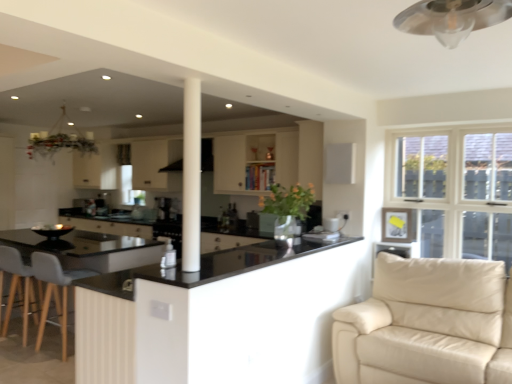
Question: Is satin black coffee machine at center positioned behind gray fabric swivel chair at lower left?

Choices:
 (A) no
 (B) yes

Answer: (B)

Question: Is satin black coffee machine at center to the left of gray fabric swivel chair at lower left from the viewer's perspective?

Choices:
 (A) no
 (B) yes

Answer: (A)

Question: Is satin black coffee machine at center not within gray fabric swivel chair at lower left?

Choices:
 (A) no
 (B) yes

Answer: (B)

Question: Can you confirm if satin black coffee machine at center is taller than gray fabric swivel chair at lower left?

Choices:
 (A) no
 (B) yes

Answer: (A)

Question: Can you confirm if satin black coffee machine at center is smaller than gray fabric swivel chair at lower left?

Choices:
 (A) yes
 (B) no

Answer: (A)

Question: Does satin black coffee machine at center have a larger size compared to gray fabric swivel chair at lower left?

Choices:
 (A) no
 (B) yes

Answer: (A)

Question: Is black glossy countertop at center, which is counted as the second countertop, starting from the top, a part of beige leather couch at lower right?

Choices:
 (A) yes
 (B) no

Answer: (B)

Question: From the image's perspective, is beige leather couch at lower right on black glossy countertop at center, which is the 1th countertop from bottom to top?

Choices:
 (A) yes
 (B) no

Answer: (B)

Question: Is beige leather couch at lower right outside black glossy countertop at center, which is counted as the second countertop, starting from the top?

Choices:
 (A) yes
 (B) no

Answer: (A)

Question: Is beige leather couch at lower right shorter than black glossy countertop at center, which is the 1th countertop from bottom to top?

Choices:
 (A) no
 (B) yes

Answer: (B)

Question: Is beige leather couch at lower right further to the viewer compared to black glossy countertop at center, which is counted as the second countertop, starting from the top?

Choices:
 (A) yes
 (B) no

Answer: (A)

Question: Does beige leather couch at lower right have a lesser width compared to black glossy countertop at center, which is the 1th countertop from bottom to top?

Choices:
 (A) yes
 (B) no

Answer: (B)

Question: From the image's perspective, is black glossy countertop at center, which is the second countertop from bottom to top, on white fabric curtain at upper center?

Choices:
 (A) yes
 (B) no

Answer: (B)